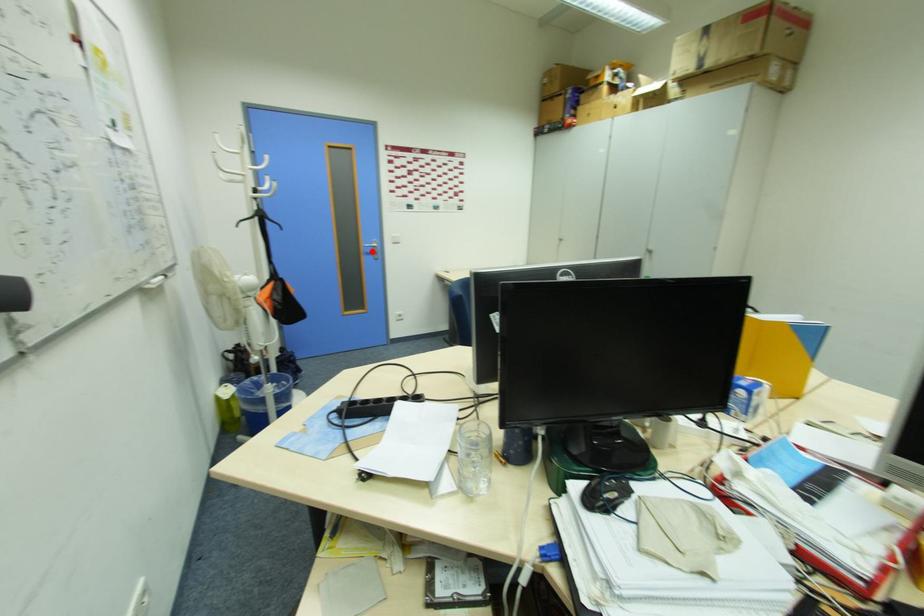
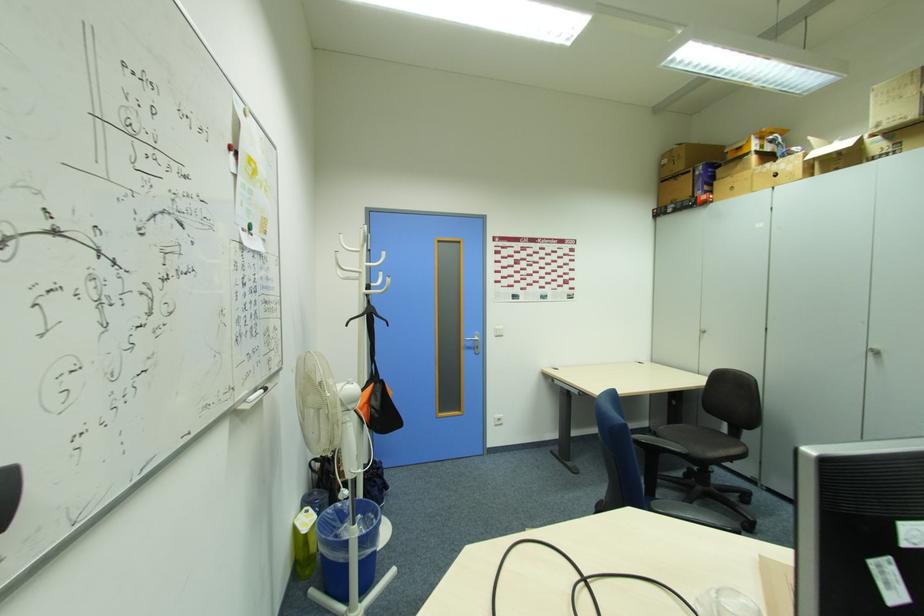
In the second image, find the point that corresponds to the highlighted location in the first image.

(472, 346)